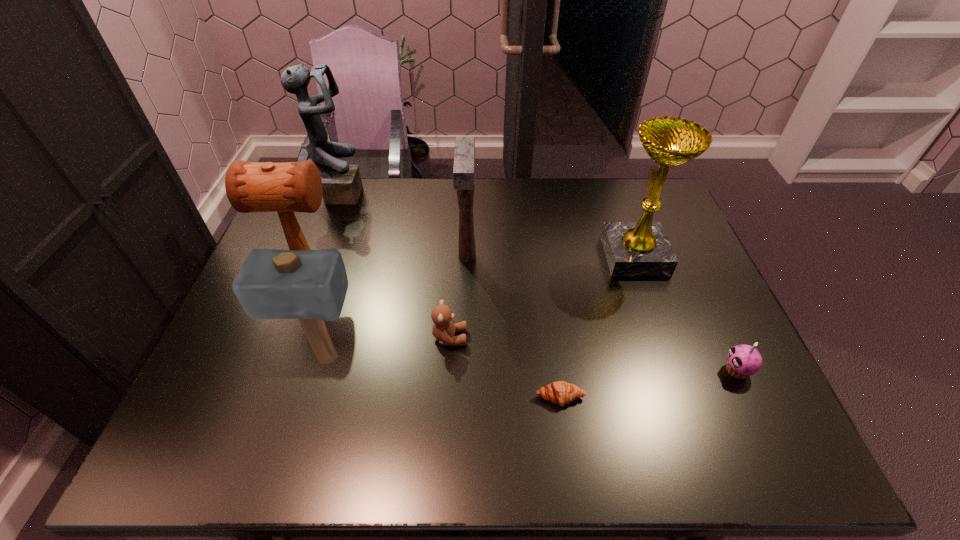
Identify the location of blank area in the image that satisfies the following two spatial constraints: 1. on the face of the farthest object; 2. on the right side of the rightmost mallet. (315, 257).